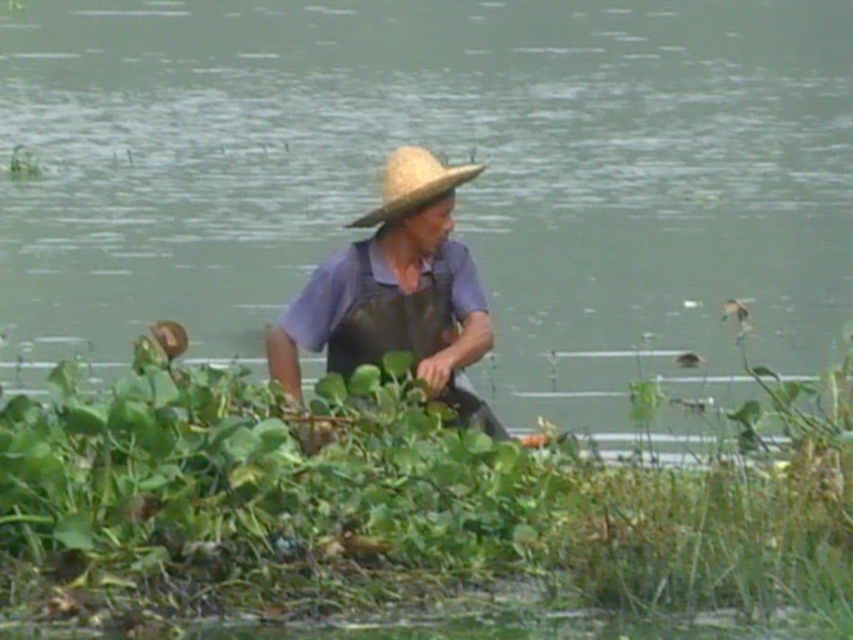
Question: Can you confirm if green leafy plants at lower center is thinner than green leafy plant at center?

Choices:
 (A) no
 (B) yes

Answer: (A)

Question: Which object appears closest to the camera in this image?

Choices:
 (A) green leafy plant at center
 (B) matte straw hat at center

Answer: (A)

Question: Does green leafy plants at lower center lie in front of green leafy plant at center?

Choices:
 (A) yes
 (B) no

Answer: (B)

Question: Can you confirm if matte straw hat at center is positioned below strawmaterial/texturehat at center?

Choices:
 (A) no
 (B) yes

Answer: (B)

Question: Which object appears closest to the camera in this image?

Choices:
 (A) green leafy plants at lower center
 (B) matte straw hat at center

Answer: (B)

Question: Which point is farther to the camera?

Choices:
 (A) strawmaterial/texturehat at center
 (B) green leafy plant at center

Answer: (A)